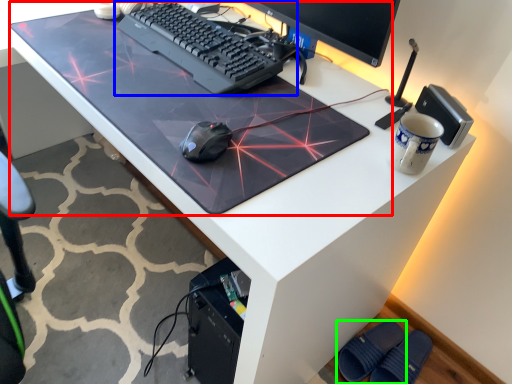
Question: Which object is the farthest from table top (highlighted by a red box)? Choose among these: computer keyboard (highlighted by a blue box) or footwear (highlighted by a green box).

Choices:
 (A) computer keyboard
 (B) footwear

Answer: (B)